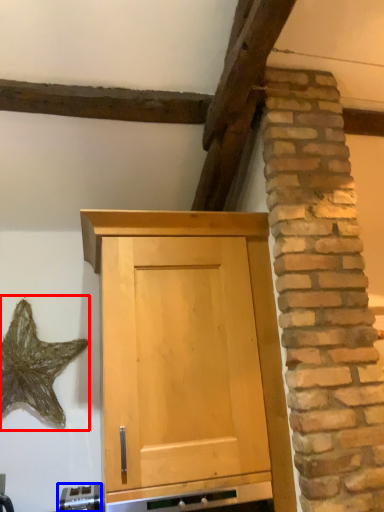
Question: Which object is closer to the camera taking this photo, star (highlighted by a red box) or appliance (highlighted by a blue box)?

Choices:
 (A) star
 (B) appliance

Answer: (B)